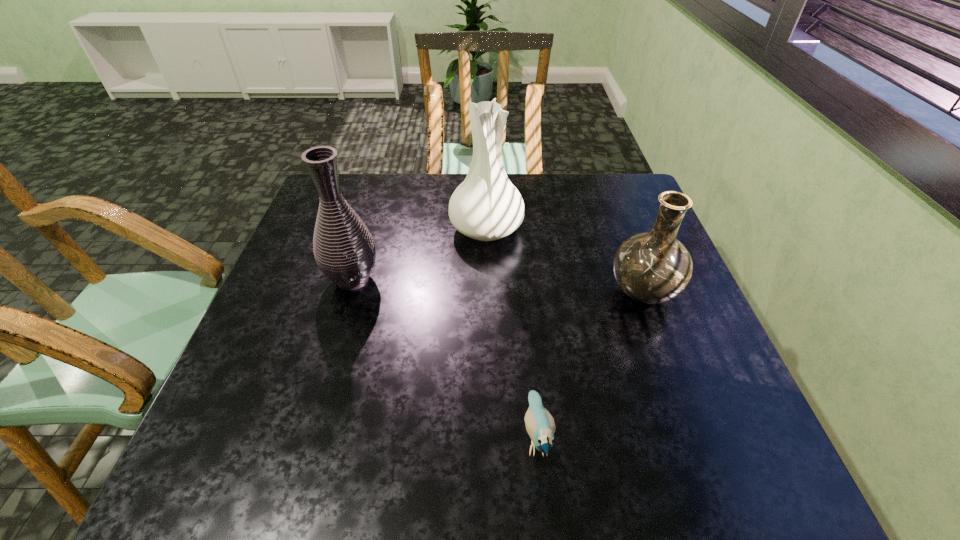
Where is `free space between the farthest vase and the shortest object`? The image size is (960, 540). free space between the farthest vase and the shortest object is located at coordinates (512, 333).

Identify the location of vacant area between the shortest vase and the nearest object. click(x=589, y=364).

Identify the location of vacant space that is in between the bird and the leftmost object. pos(444,357).

The image size is (960, 540). What are the coordinates of `empty space that is in between the rightmost vase and the leftmost vase` in the screenshot? It's located at (497, 286).

Locate an element on the screen. The image size is (960, 540). vacant area that lies between the leftmost object and the rightmost vase is located at coordinates (497, 286).

What are the coordinates of `unoccupied position between the bird and the farthest object` in the screenshot? It's located at (512, 333).

What are the coordinates of `empty space that is in between the farthest object and the leftmost vase` in the screenshot? It's located at (420, 254).

Locate which object is the third closest to the rightmost vase. Please provide its 2D coordinates. Your answer should be formatted as a tuple, i.e. [(x, y)], where the tuple contains the x and y coordinates of a point satisfying the conditions above.

[(345, 252)]

This screenshot has width=960, height=540. In order to click on the second closest object to the leftmost vase in this screenshot , I will do `click(540, 425)`.

Where is `vase that is the closest to the second vase from left to right`? vase that is the closest to the second vase from left to right is located at coordinates (345, 252).